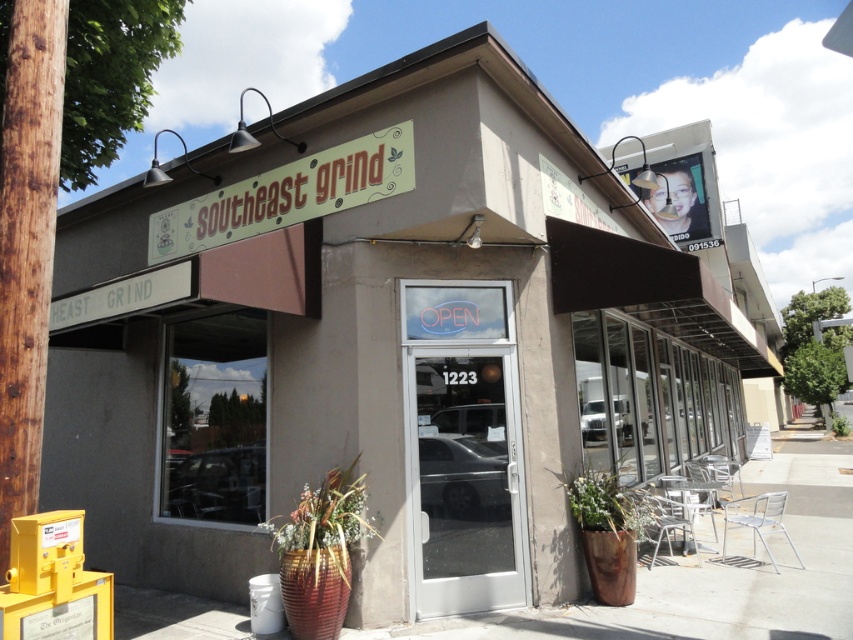
You are a delivery person trying to secure a package to the brown wood pole at left and the white painted wood signboard at upper center. Which object is more suitable for securing the package based on their thickness?

The white painted wood signboard at upper center is thicker than the brown wood pole at left, making it more suitable for securing the package.

You are a customer approaching the entrance of Southeast Grind. You see the brown wood pole at left and the white painted wood signboard at upper center. Which object is closer to the ground?

The brown wood pole at left is closer to the ground because it is below the white painted wood signboard at upper center.

You are standing at the entrance of the Southeast Grind cafe and want to find the brown wood pole at left. According to the scene, where would you look relative to the entrance?

The brown wood pole at left is located to the left side of the entrance.